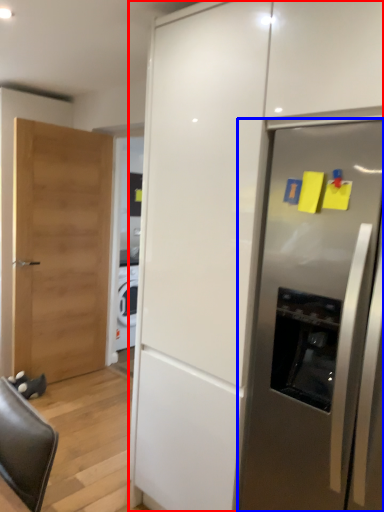
Question: Which object appears closest to the camera in this image, cabinetry (highlighted by a red box) or refrigerator (highlighted by a blue box)?

Choices:
 (A) cabinetry
 (B) refrigerator

Answer: (A)